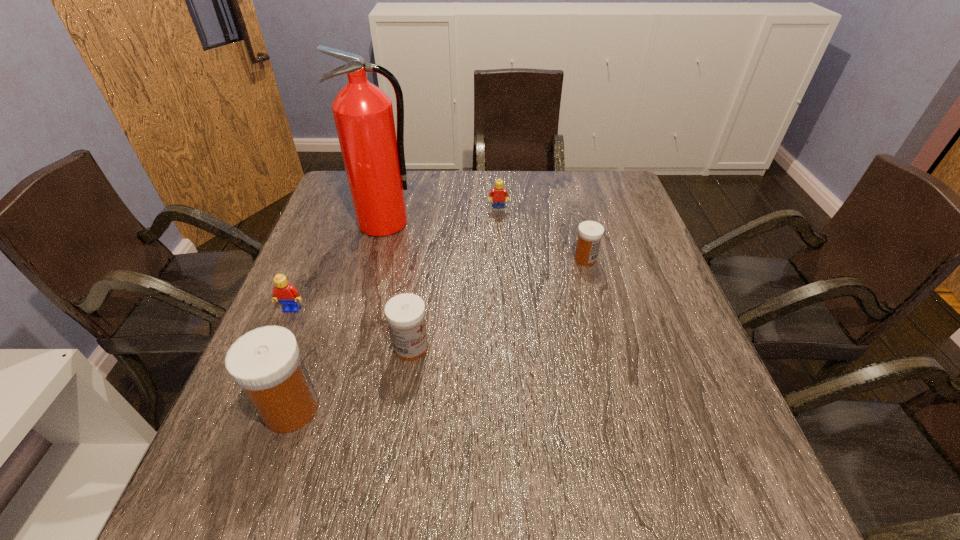
You are a GUI agent. You are given a task and a screenshot of the screen. Output one action in this format:
    pyautogui.click(x=<x>, y=<y>)
    Task: Click on the nearest object
    
    Given the screenshot: What is the action you would take?
    pyautogui.click(x=266, y=362)

This screenshot has height=540, width=960. In order to click on the leftmost medicine in this screenshot , I will do pos(266,362).

Find the location of `the second nearest object`. the second nearest object is located at coordinates (405, 313).

Locate an element on the screen. the second medicine from left to right is located at coordinates (405, 313).

Find the location of `the shortest medicine`. the shortest medicine is located at coordinates 590,233.

Locate an element on the screen. The width and height of the screenshot is (960, 540). the farthest medicine is located at coordinates (590, 233).

The image size is (960, 540). Find the location of `the right Lego`. the right Lego is located at coordinates (498, 194).

Where is `the second object from right to left`? the second object from right to left is located at coordinates (498, 194).

Locate an element on the screen. The image size is (960, 540). the tallest object is located at coordinates (374, 160).

Locate an element on the screen. The width and height of the screenshot is (960, 540). the nearer Lego is located at coordinates (287, 295).